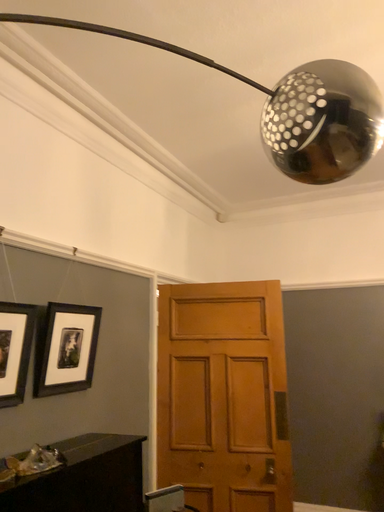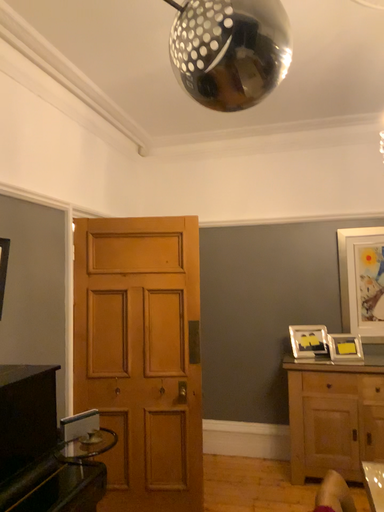
Question: Which way did the camera rotate in the video?

Choices:
 (A) rotated right
 (B) rotated left

Answer: (A)